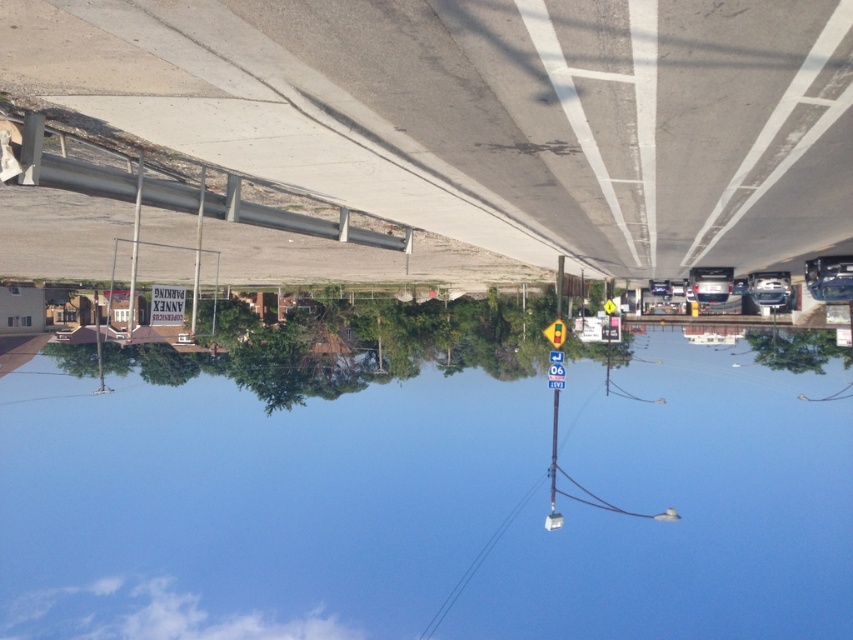
Question: Does transparent glass water at center appear over silver metallic sedan at center?

Choices:
 (A) no
 (B) yes

Answer: (A)

Question: Estimate the real-world distances between objects in this image. Which object is farther from the transparent glass water at center?

Choices:
 (A) concrete overpass at center
 (B) silver metallic sedan at center

Answer: (B)

Question: Which object is positioned farthest from the metallic silver car at right?

Choices:
 (A) satin silver sedan at center
 (B) transparent glass water at center
 (C) concrete overpass at center
 (D) silver metallic sedan at center

Answer: (B)

Question: Does concrete overpass at center have a larger size compared to metallic silver car at right?

Choices:
 (A) yes
 (B) no

Answer: (A)

Question: Which point is farther to the camera?

Choices:
 (A) silver metallic sedan at center
 (B) satin silver sedan at center
 (C) concrete overpass at center
 (D) metallic silver car at right

Answer: (A)

Question: Is concrete overpass at center positioned at the back of metallic silver car at right?

Choices:
 (A) no
 (B) yes

Answer: (A)